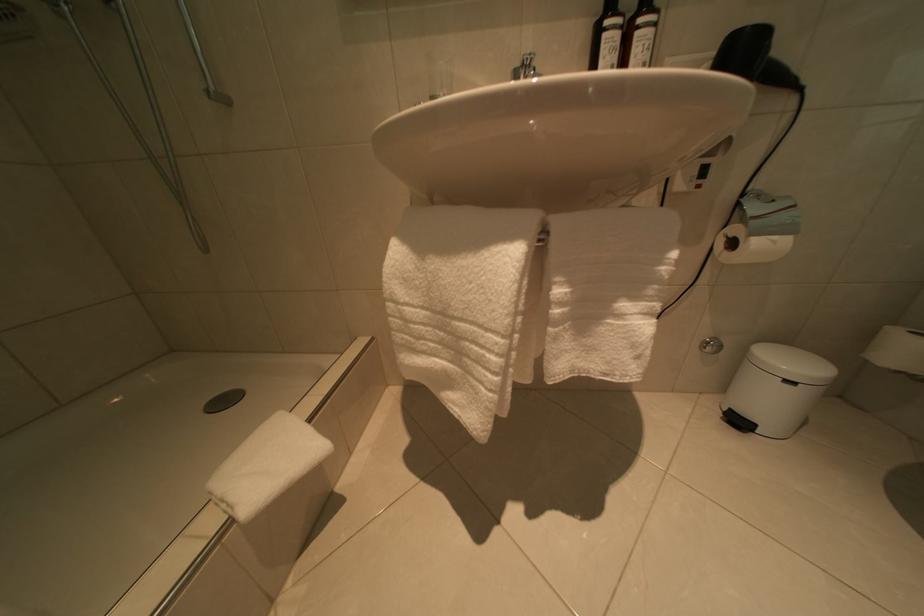
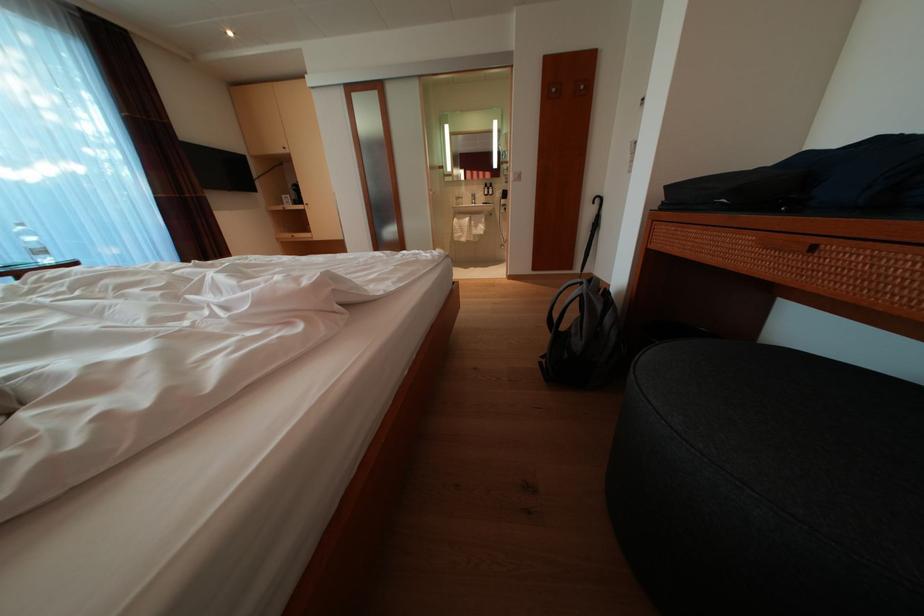
Where in the second image is the point corresponding to [517,262] from the first image?

(476, 225)